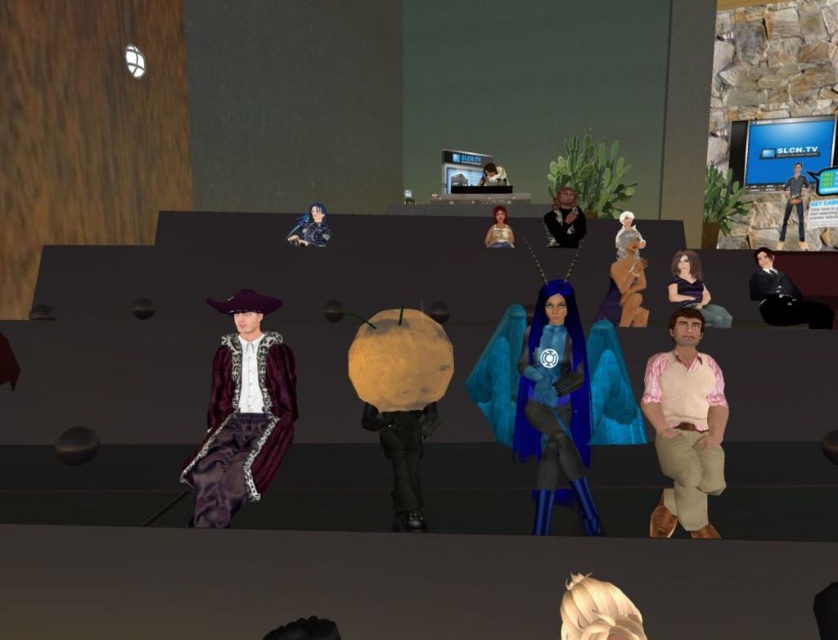
Question: Which point is farther from the camera taking this photo?

Choices:
 (A) click(x=552, y=282)
 (B) click(x=324, y=221)
 (C) click(x=751, y=168)
 (D) click(x=691, y=300)

Answer: (C)

Question: Which of these objects is positioned closest to the velvet maroon coat at left?

Choices:
 (A) matte black jacket at upper center
 (B) matte gold dress at center
 (C) matte black character at upper center

Answer: (B)

Question: Estimate the real-world distances between objects in this image. Which object is closer to the matte gold dress at center?

Choices:
 (A) matte black character at upper center
 (B) matte black jacket at upper center
 (C) matte black shirt at center

Answer: (B)

Question: Can you confirm if matte black dress at center is thinner than denim jeans at right?

Choices:
 (A) no
 (B) yes

Answer: (A)

Question: Does velvet maroon coat at left appear over matte black dress at center?

Choices:
 (A) yes
 (B) no

Answer: (B)

Question: Does blue glossy cape at center come in front of velvet maroon coat at left?

Choices:
 (A) yes
 (B) no

Answer: (B)